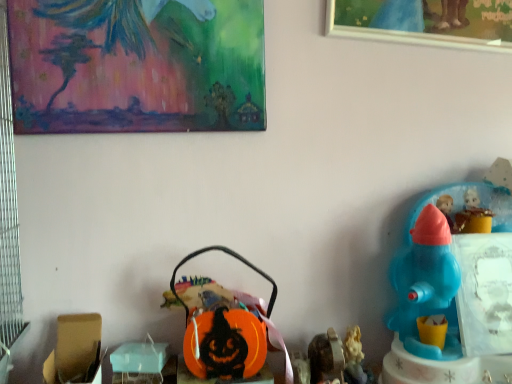
Question: Does blue plastic toy at right, placed as the 1th toy when sorted from right to left, appear on the right side of orange plastic basket at center, which appears as the 4th toy when viewed from the right?

Choices:
 (A) no
 (B) yes

Answer: (B)

Question: Does blue plastic toy at right, placed as the 1th toy when sorted from right to left, lie behind orange plastic basket at center, which appears as the 4th toy when viewed from the right?

Choices:
 (A) yes
 (B) no

Answer: (B)

Question: Is orange plastic basket at center, the 2th toy in the left-to-right sequence, completely or partially inside blue plastic toy at right, placed as the 1th toy when sorted from right to left?

Choices:
 (A) yes
 (B) no

Answer: (B)

Question: From a real-world perspective, is blue plastic toy at right, placed as the 1th toy when sorted from right to left, on orange plastic basket at center, which appears as the 4th toy when viewed from the right?

Choices:
 (A) yes
 (B) no

Answer: (A)

Question: From a real-world perspective, does blue plastic toy at right, placed as the fifth toy when sorted from left to right, sit lower than orange plastic basket at center, which appears as the 4th toy when viewed from the right?

Choices:
 (A) no
 (B) yes

Answer: (A)

Question: From a real-world perspective, is wooden picture frame at upper right, which ranks as the second picture frame in left-to-right order, positioned above or below matte plastic figurine at lower right, the 2th toy from the right?

Choices:
 (A) above
 (B) below

Answer: (A)

Question: Is wooden picture frame at upper right, which ranks as the second picture frame in left-to-right order, taller or shorter than matte plastic figurine at lower right, arranged as the fourth toy when viewed from the left?

Choices:
 (A) tall
 (B) short

Answer: (A)

Question: Is point (404, 28) positioned closer to the camera than point (360, 372)?

Choices:
 (A) closer
 (B) farther

Answer: (B)

Question: In the image, is wooden picture frame at upper right, the 1th picture frame viewed from the right, on the left side or the right side of matte plastic figurine at lower right, the 2th toy from the right?

Choices:
 (A) right
 (B) left

Answer: (A)

Question: In terms of size, does orange plastic basket at center, the 2th toy in the left-to-right sequence, appear bigger or smaller than wooden picture frame at upper right, the 1th picture frame viewed from the right?

Choices:
 (A) big
 (B) small

Answer: (B)

Question: Is point (206, 332) closer or farther from the camera than point (458, 39)?

Choices:
 (A) closer
 (B) farther

Answer: (A)

Question: From the image's perspective, is orange plastic basket at center, which appears as the 4th toy when viewed from the right, above or below wooden picture frame at upper right, which ranks as the second picture frame in left-to-right order?

Choices:
 (A) below
 (B) above

Answer: (A)

Question: Is orange plastic basket at center, which appears as the 4th toy when viewed from the right, wider or thinner than wooden picture frame at upper right, which ranks as the second picture frame in left-to-right order?

Choices:
 (A) thin
 (B) wide

Answer: (B)

Question: From the image's perspective, is metallic silver toy at lower center, marked as the third toy in a left-to-right arrangement, positioned above or below painted canvas at upper left, arranged as the first picture frame when viewed from the left?

Choices:
 (A) above
 (B) below

Answer: (B)

Question: Is point (334, 355) positioned closer to the camera than point (225, 24)?

Choices:
 (A) farther
 (B) closer

Answer: (B)